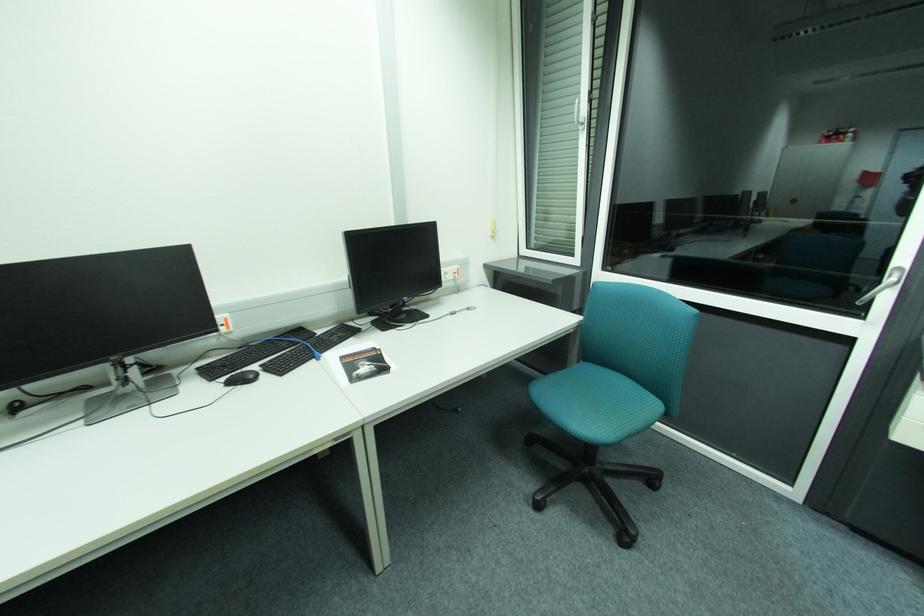
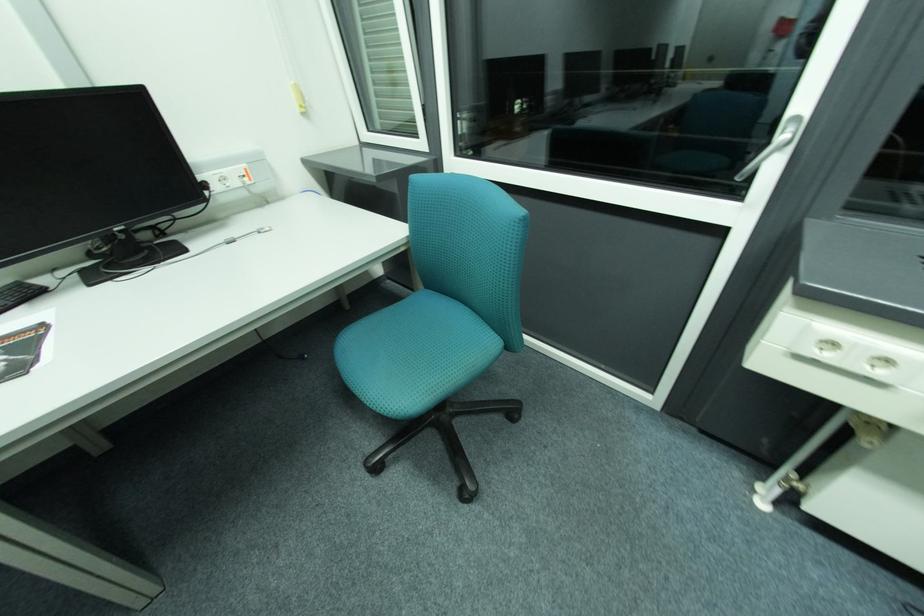
Which direction would the cameraman need to move to produce the second image?

The cameraman moved toward right, forward.